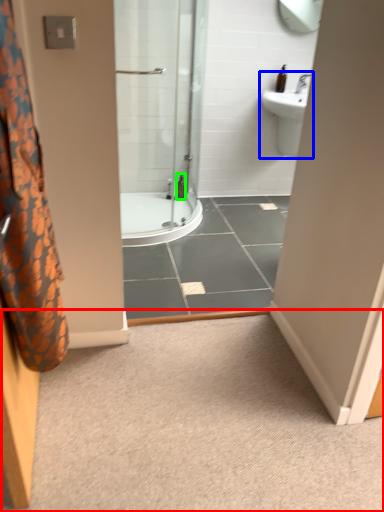
Question: Which is farther away from plain (highlighted by a red box)? sink (highlighted by a blue box) or toiletry (highlighted by a green box)?

Choices:
 (A) sink
 (B) toiletry

Answer: (A)